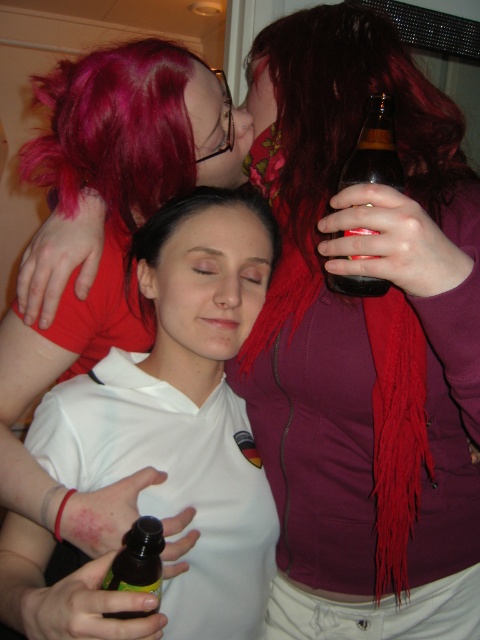
Question: Among these points, which one is nearest to the camera?

Choices:
 (A) (108, 442)
 (B) (237, 195)
 (C) (370, 170)
 (D) (117, 582)

Answer: (D)

Question: From the image, what is the correct spatial relationship of matte white shirt at center in relation to brown glass bottle at upper right?

Choices:
 (A) right
 (B) left

Answer: (B)

Question: Can you confirm if white matte shirt at center is smaller than translucent plastic bottle at center?

Choices:
 (A) yes
 (B) no

Answer: (B)

Question: Which of the following is the closest to the observer?

Choices:
 (A) matte white shirt at center
 (B) translucent plastic bottle at center

Answer: (B)

Question: Which object appears closest to the camera in this image?

Choices:
 (A) white matte shirt at center
 (B) translucent plastic bottle at center
 (C) brown glass bottle at upper right

Answer: (A)

Question: Can you confirm if matte white shirt at center is wider than translucent plastic bottle at center?

Choices:
 (A) no
 (B) yes

Answer: (B)